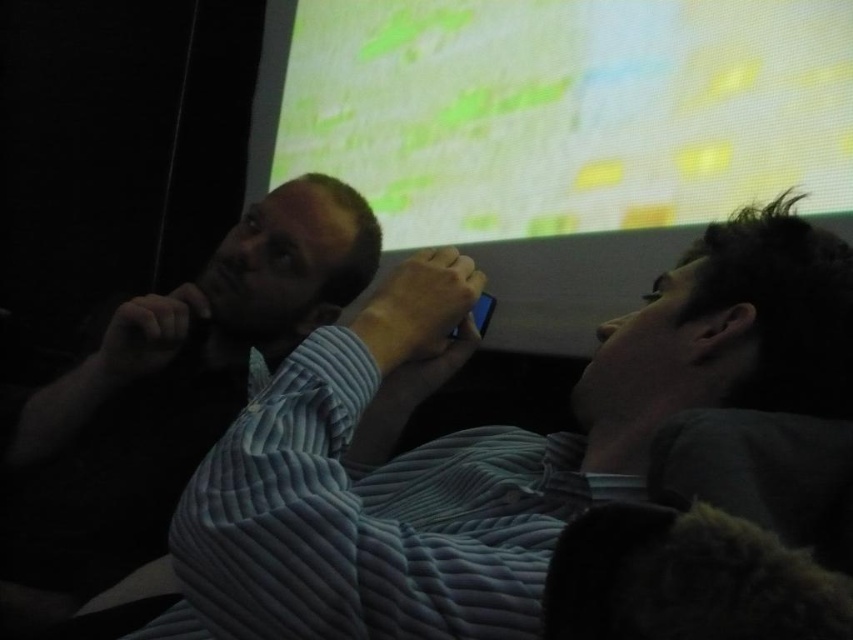
Question: Among these points, which one is farthest from the camera?

Choices:
 (A) (91, 384)
 (B) (389, 477)

Answer: (A)

Question: Does blue corduroy shirt at center lie behind blue striped shirt at left?

Choices:
 (A) yes
 (B) no

Answer: (B)

Question: Can you confirm if blue corduroy shirt at center is bigger than blue striped shirt at left?

Choices:
 (A) yes
 (B) no

Answer: (B)

Question: Among these points, which one is nearest to the camera?

Choices:
 (A) (85, 548)
 (B) (503, 616)

Answer: (B)

Question: Is blue corduroy shirt at center closer to camera compared to blue striped shirt at left?

Choices:
 (A) yes
 (B) no

Answer: (A)

Question: Which point is closer to the camera?

Choices:
 (A) blue corduroy shirt at center
 (B) blue striped shirt at left

Answer: (A)